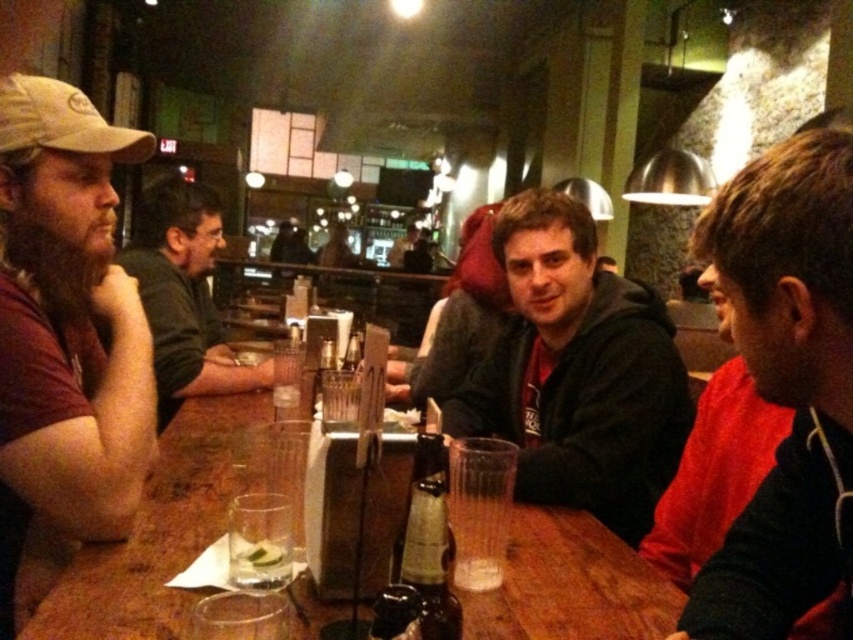
You are a photographer standing in the bar and want to take a photo of the dark green sweater at left and the red matte shirt at right. Which one is covering the other?

The dark green sweater at left is positioned over the red matte shirt at right, so it is covering it.

You are a bartender who needs to place a new coaster on the wooden table at center. The coaster you have is the same size as the brown matte cap at left. Will the coaster fit under the cap?

The brown matte cap at left is taller than the wooden table at center, so the coaster will not fit under the cap since the cap is taller than the table.

You are a waiter in a crowded bar. You need to place a new drink order for the customers seated at the wooden table at center. However, there is a light beige fabric baseball cap at upper left on the table. Can you fit the drink on the table without moving the hat?

The wooden table at center is bigger than the light beige fabric baseball cap at upper left, so there is enough space to place the drink on the table without moving the hat.